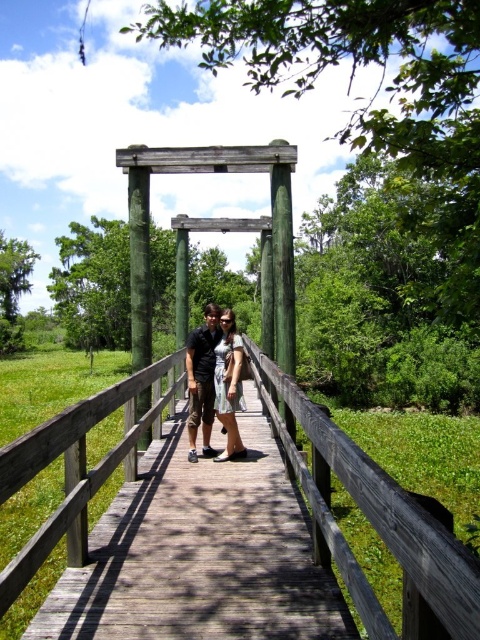
You are a photographer standing on the wooden bridge and want to position yourself so that the green wood post at center is exactly in the center of your camera viewfinder. Where should you move relative to the current position?

Since the green wood post at center is located at coordinates (140, 266), you should move towards the lower right direction to center it in your viewfinder.

You are a photographer planning to take a wide shot of the wooden bridge at center and the dark gray shirt at center. Based on their sizes, which object would appear larger in the photo?

The wooden bridge at center would appear larger in the photo because it is wider than the dark gray shirt at center.